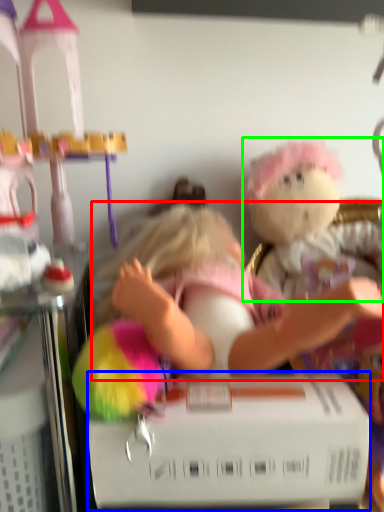
Question: Which is farther away from person (highlighted by a red box)? box (highlighted by a blue box) or toy (highlighted by a green box)?

Choices:
 (A) box
 (B) toy

Answer: (B)